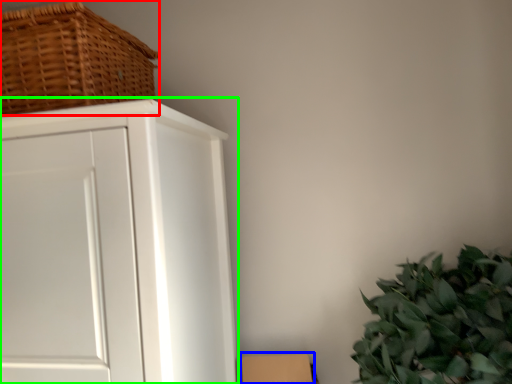
Question: Based on their relative distances, which object is nearer to basket (highlighted by a red box)? Choose from cardboard box (highlighted by a blue box) and cupboard (highlighted by a green box).

Choices:
 (A) cardboard box
 (B) cupboard

Answer: (B)